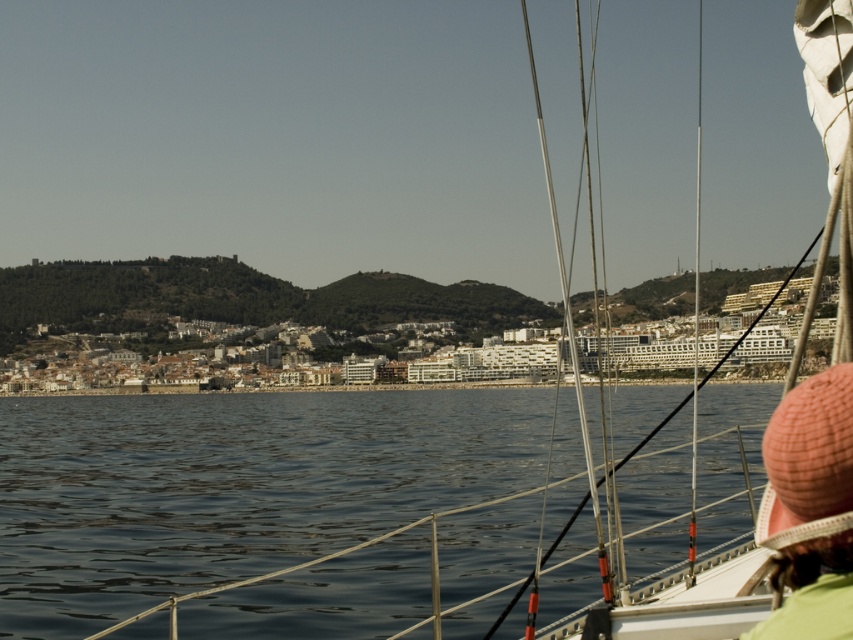
Can you confirm if dark blue water at center is shorter than pink knitted hat at lower right?

In fact, dark blue water at center may be taller than pink knitted hat at lower right.

Which is in front, point (235, 579) or point (831, 570)?

Positioned in front is point (831, 570).

Is point (735, 394) positioned before point (831, 392)?

No, (735, 394) is further to viewer.

I want to click on dark blue water at center, so click(x=250, y=492).

Who is taller, dark blue water at center or metallic silver mast at right?

Standing taller between the two is metallic silver mast at right.

Does point (193, 620) come closer to viewer compared to point (697, 250)?

Yes, it is in front of point (697, 250).

This screenshot has width=853, height=640. What are the coordinates of `dark blue water at center` in the screenshot? It's located at (250, 492).

Between pink knitted hat at lower right and metallic silver mast at right, which one appears on the left side from the viewer's perspective?

pink knitted hat at lower right is more to the left.

Can you confirm if pink knitted hat at lower right is shorter than metallic silver mast at right?

Yes, pink knitted hat at lower right is shorter than metallic silver mast at right.

Locate an element on the screen. pink knitted hat at lower right is located at coordinates (809, 508).